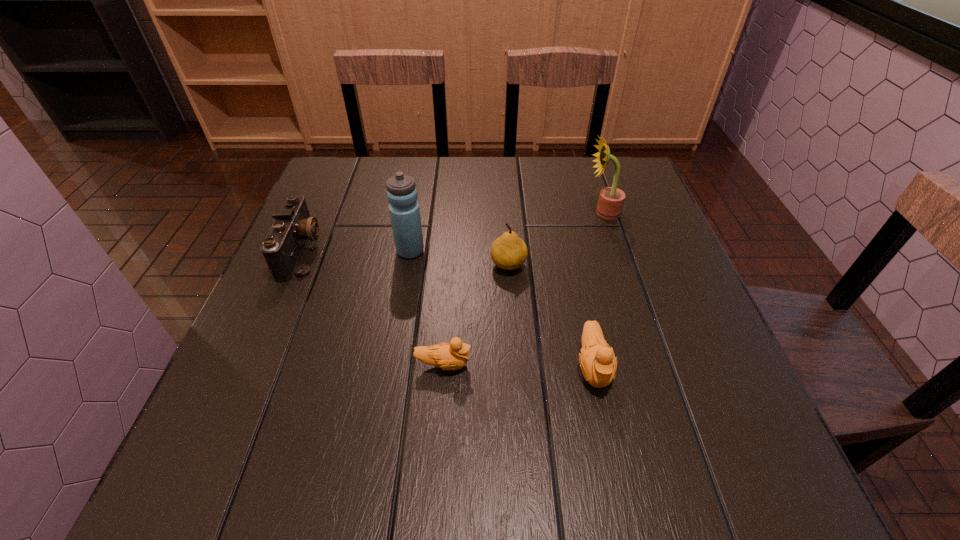
At what (x,y) coordinates should I click in order to perform the action: click on empty space that is in between the camera and the rightmost object. Please return your answer as a coordinate pair (x, y). Image resolution: width=960 pixels, height=540 pixels. Looking at the image, I should click on (452, 231).

Where is `vacant area between the water bottle and the fourth object from left to right`? The height and width of the screenshot is (540, 960). vacant area between the water bottle and the fourth object from left to right is located at coordinates (459, 258).

At what (x,y) coordinates should I click in order to perform the action: click on free space between the third object from left to right and the sunflower. Please return your answer as a coordinate pair (x, y). Image resolution: width=960 pixels, height=540 pixels. Looking at the image, I should click on (523, 288).

Locate an element on the screen. The image size is (960, 540). vacant space that's between the sunflower and the camera is located at coordinates (452, 231).

Find the location of `object that ranks as the closest to the rightmost object`. object that ranks as the closest to the rightmost object is located at coordinates (508, 252).

This screenshot has width=960, height=540. Identify the location of the closest object to the right duckling. (x=508, y=252).

Identify the location of free location that satisfies the following two spatial constraints: 1. on the front-facing side of the water bottle; 2. on the right side of the leftmost object. (301, 251).

The image size is (960, 540). Identify the location of free space that satisfies the following two spatial constraints: 1. on the back side of the pear; 2. on the front-facing side of the camera. (507, 251).

You are a GUI agent. You are given a task and a screenshot of the screen. Output one action in this format:
    pyautogui.click(x=<x>, y=<y>)
    Task: Click on the free location that satisfies the following two spatial constraints: 1. on the front-facing side of the second object from left to right; 2. on the right side of the camera
    This screenshot has width=960, height=540.
    Given the screenshot: What is the action you would take?
    point(301,251)